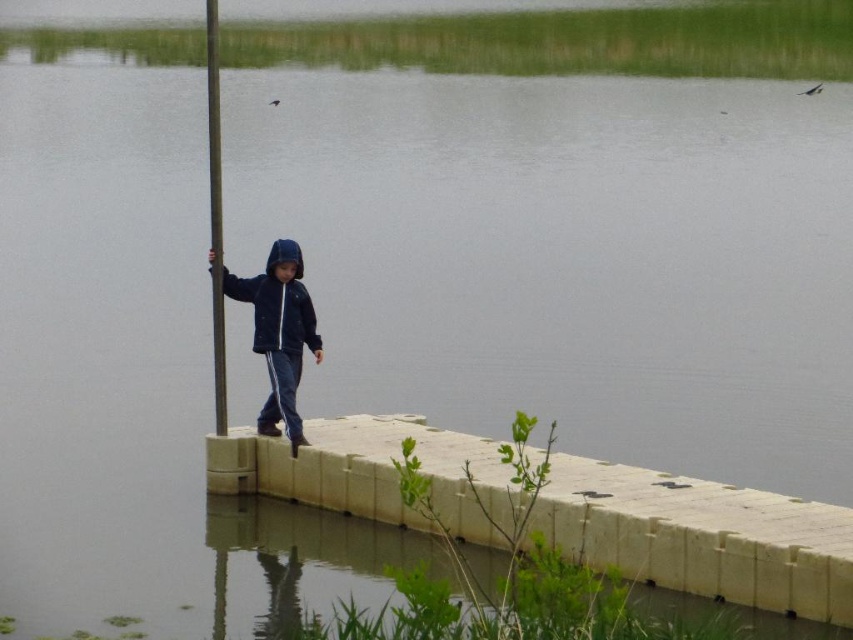
You are standing at the point labeled point (618, 528) and want to move to the point labeled point (207, 83). Given that you can only walk along the pathway, which direction should you face to move towards the second point?

You should face towards the right side of the pathway to move from point (618, 528) to point (207, 83) since the pathway curves slightly towards the right side of the frame.

You are a parent watching your child walk along the pathway. You notice the dark blue jacket at center and the metallic pole at left. Which object is taller?

The metallic pole at left is taller than the dark blue jacket at center.

You are a drone operator trying to capture a photo of the child walking on the pathway. The child is moving along the path from left to right. You need to position your drone to capture the child at two specific points marked as point 1 at (277, 374) and point 2 at (218, 404). Which point should you aim for first to ensure the sequence of the child moving from left to right is captured correctly?

Point 1 at (277, 374) should be aimed for first because it is in front of point 2 at (218, 404). Since the child is moving from left to right, capturing the point in front first maintains the correct sequence.